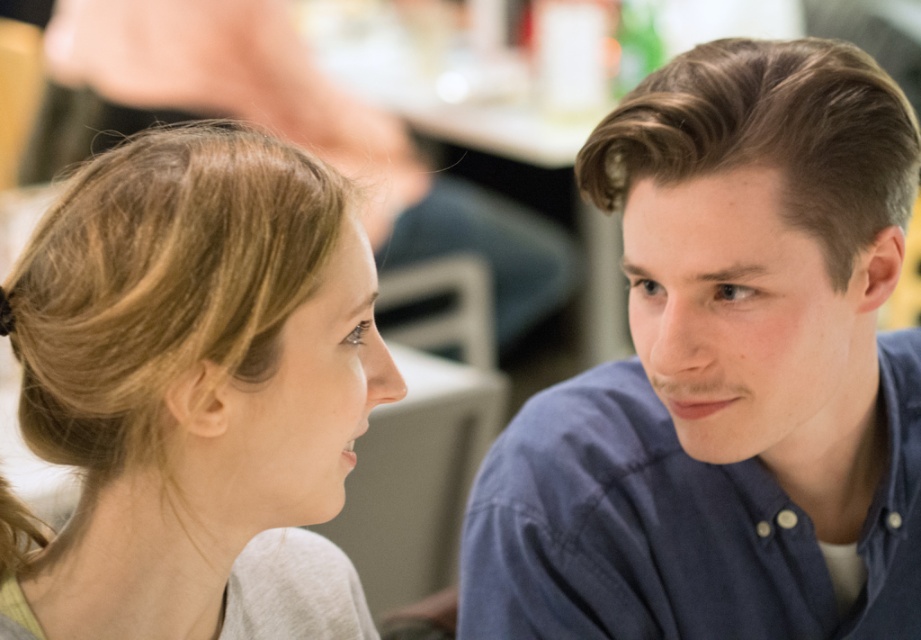
Question: Which object is closer to the camera taking this photo?

Choices:
 (A) blonde hair at left
 (B) blue cotton shirt at right

Answer: (A)

Question: Is blue cotton shirt at right positioned at the back of blonde hair at left?

Choices:
 (A) no
 (B) yes

Answer: (B)

Question: Which point is closer to the camera taking this photo?

Choices:
 (A) (259, 168)
 (B) (864, 609)

Answer: (A)

Question: Can you confirm if blue cotton shirt at right is bigger than blonde hair at left?

Choices:
 (A) no
 (B) yes

Answer: (B)

Question: Does blue cotton shirt at right have a larger size compared to blonde hair at left?

Choices:
 (A) no
 (B) yes

Answer: (B)

Question: Which point is closer to the camera taking this photo?

Choices:
 (A) (239, 365)
 (B) (517, 628)

Answer: (A)